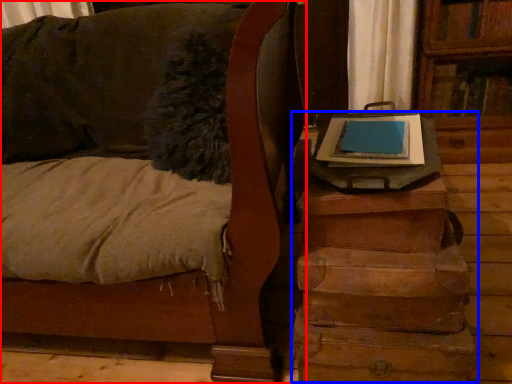
Question: Which object is further to the camera taking this photo, furniture (highlighted by a red box) or table (highlighted by a blue box)?

Choices:
 (A) furniture
 (B) table

Answer: (B)